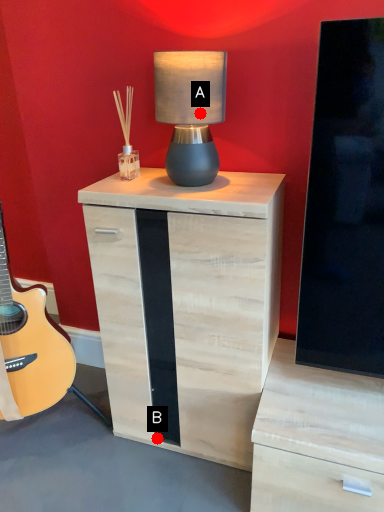
Question: Two points are circled on the image, labeled by A and B beside each circle. Which point is farther to the camera?

Choices:
 (A) A is further
 (B) B is further

Answer: (B)